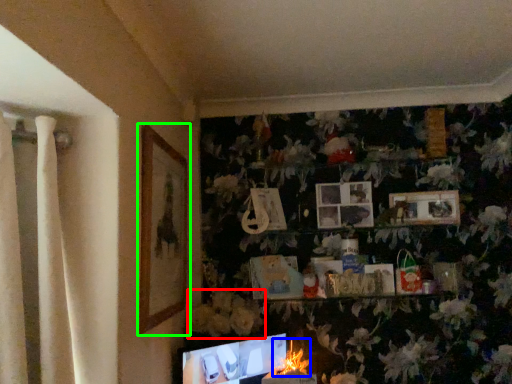
Question: Estimate the real-world distances between objects in this image. Which object is farther from flower (highlighted by a red box), flower (highlighted by a blue box) or picture frame (highlighted by a green box)?

Choices:
 (A) flower
 (B) picture frame

Answer: (B)